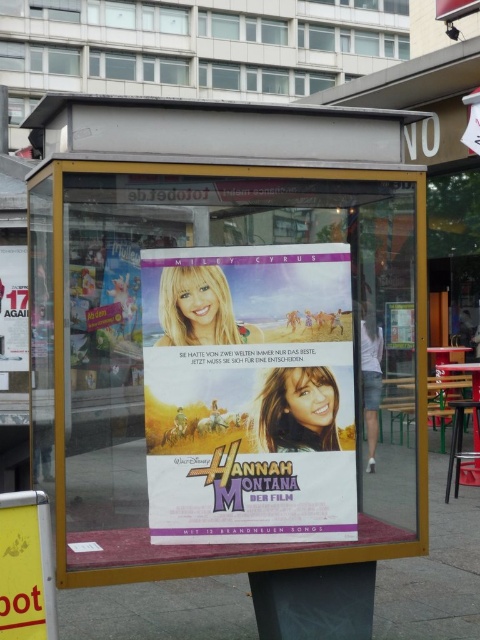
You are at a bus stop and see two movie posters. One is the matte paper poster at center and the other is the white glossy poster at upper left. Which poster is positioned lower?

The matte paper poster at center is positioned lower than the white glossy poster at upper left.

You are a pedestrian standing at the bus stop. You want to read the movie poster displayed on the transparent glass poster at center and also check the time on the digital clock placed on the white concrete pavement at lower center. Which object should you look at first to avoid turning your head?

You should look at the transparent glass poster at center first because it is to the left of the white concrete pavement at lower center, so you can read the poster and then glance to the right to check the clock without turning your head further.